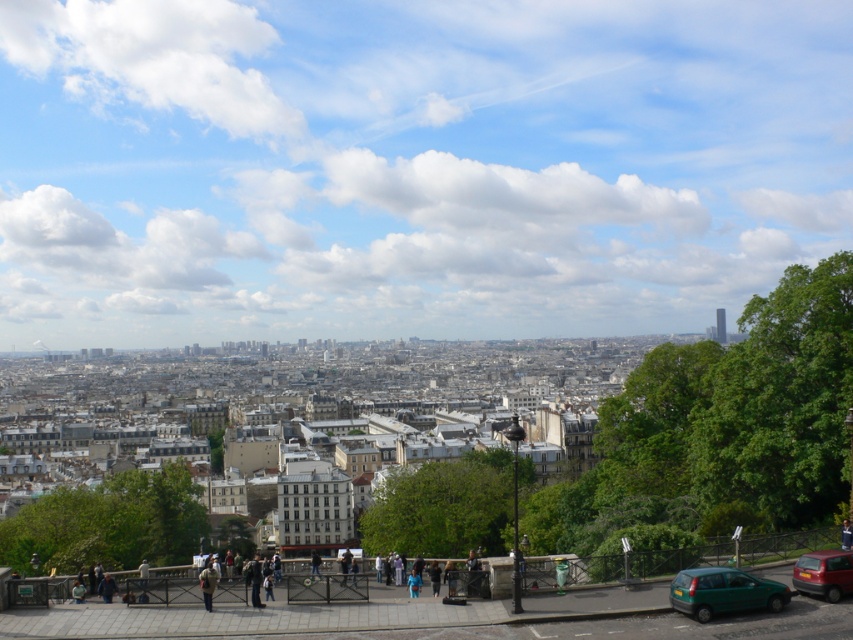
You are standing at the center of the paved area in the cityscape image. You see a point marked at coordinates [824,573]. What object is located at that point?

The point at coordinates [824,573] indicates a matte red car at lower right.

You are a photographer standing at the railing in the foreground of the cityscape. You want to take a photo of the shiny metallic tower at upper right without the green matte car at lower right blocking it. Where should you move to ensure the tower is fully visible?

Move to the left side of the railing so that the green matte car at lower right is no longer between you and the shiny metallic tower at upper right.